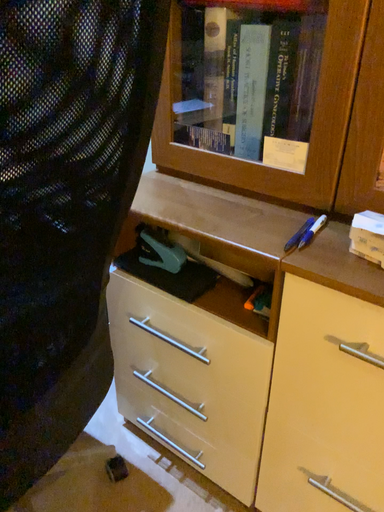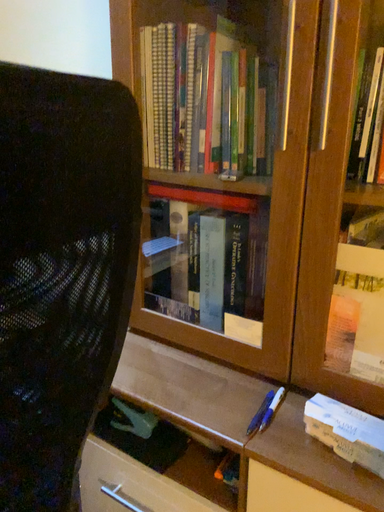
Question: Which way did the camera rotate in the video?

Choices:
 (A) rotated downward
 (B) rotated upward

Answer: (B)